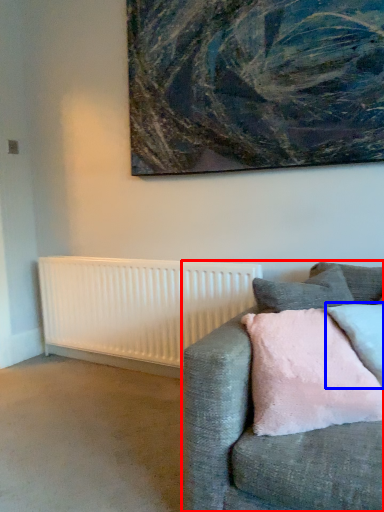
Question: Which point is closer to the camera, studio couch (highlighted by a red box) or pillow (highlighted by a blue box)?

Choices:
 (A) studio couch
 (B) pillow

Answer: (A)